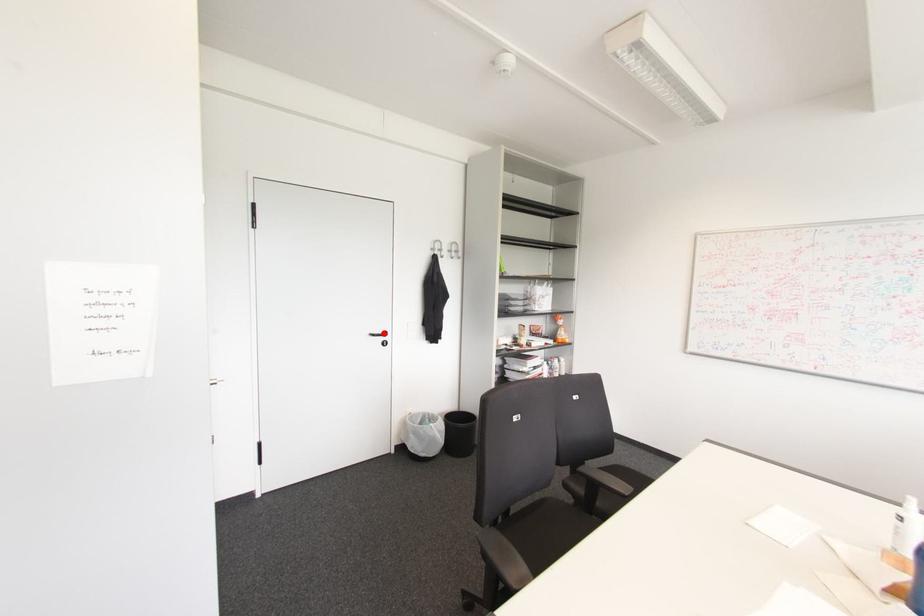
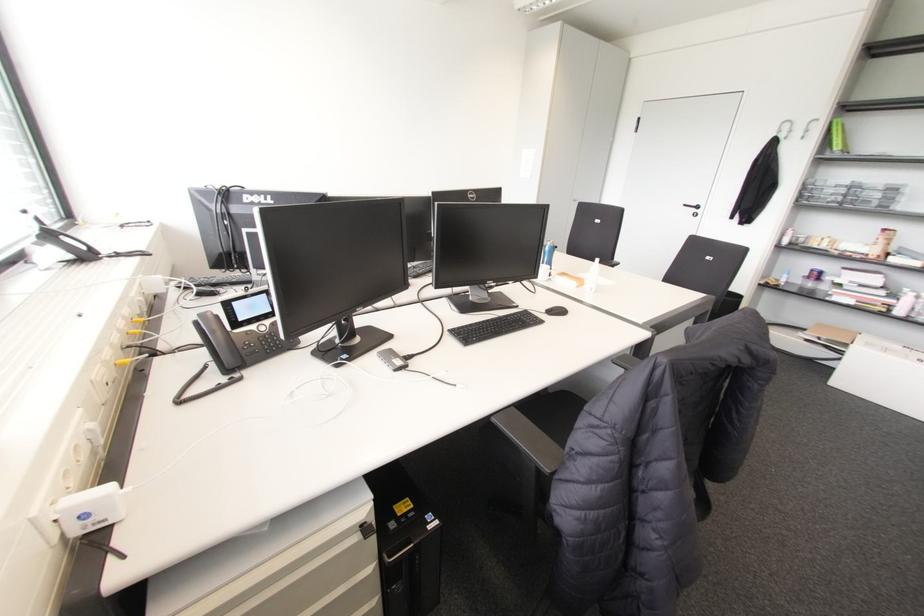
Locate, in the second image, the point that corresponds to the highlighted location in the first image.

(697, 207)